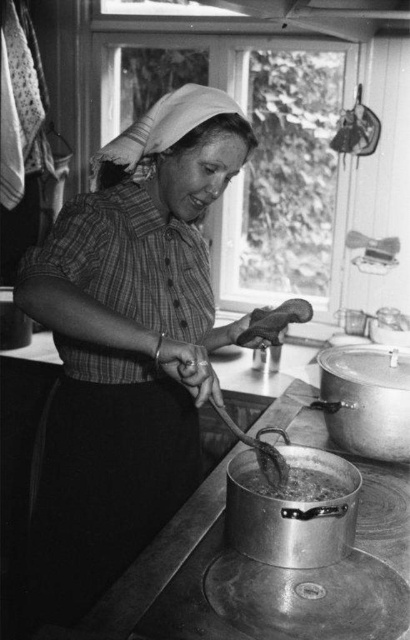
Question: In this image, where is matte plaid shirt at center located relative to boiling liquid at lower center?

Choices:
 (A) above
 (B) below

Answer: (A)

Question: Is matte plaid shirt at center further to camera compared to boiling liquid at lower center?

Choices:
 (A) yes
 (B) no

Answer: (B)

Question: Among these points, which one is farthest from the camera?

Choices:
 (A) (182, 109)
 (B) (325, 477)

Answer: (B)

Question: Is matte plaid shirt at center further to the viewer compared to boiling liquid at lower center?

Choices:
 (A) yes
 (B) no

Answer: (B)

Question: Which of the following is the closest to the observer?

Choices:
 (A) (319, 486)
 (B) (50, 268)

Answer: (B)

Question: Which point is farther from the camera taking this photo?

Choices:
 (A) (300, 470)
 (B) (66, 589)

Answer: (B)